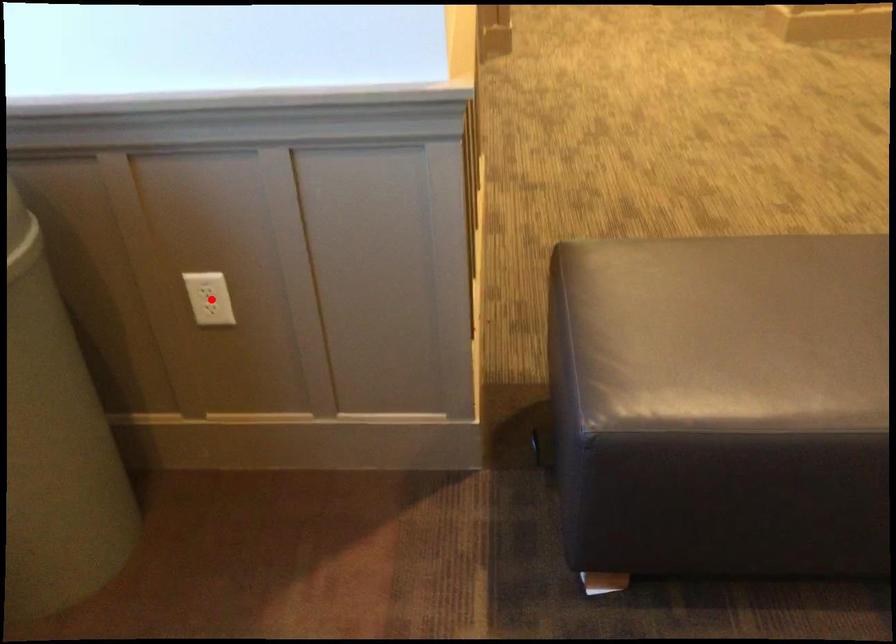
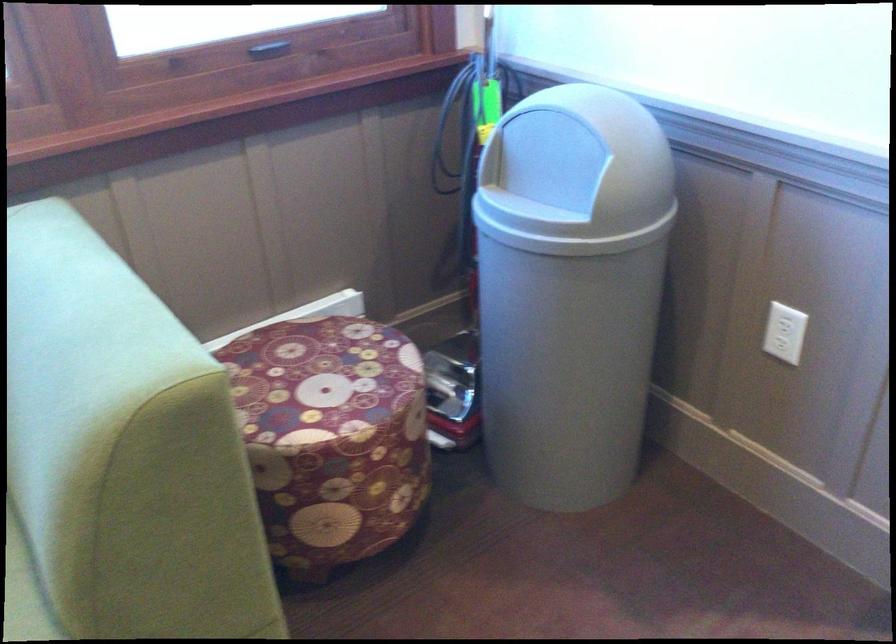
In the second image, find the point that corresponds to the highlighted location in the first image.

(787, 328)